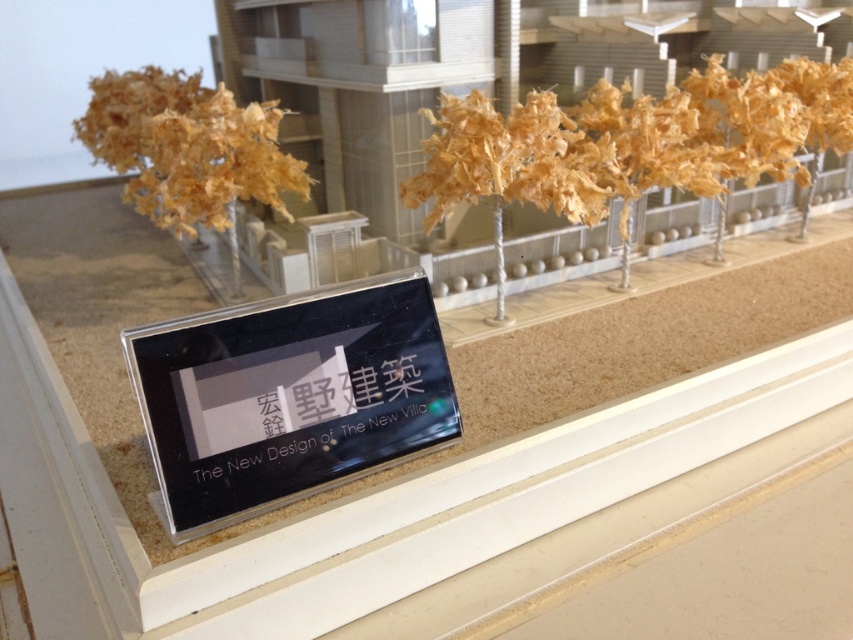
You are examining the architectural model of the villa complex. You notice two points marked in the scene. The first point is located at coordinates point [79,314], and the second is at point [175,195]. From your viewpoint, which point is closer to you?

Point [175,195] is closer to you because it is less further to the camera than point [79,314].

You are a visitor at the architectural model exhibition. You see the point marked at coordinate [636,140]. What does this point indicate?

The point at coordinate [636,140] indicates light brown papier mache trees at upper center.

You are examining a miniature architectural model of a villa complex. You notice two points marked in the scene. The first point is located at coordinates point (425, 182), and the second point is at point (224, 209). From your perspective as an observer, which of these two points appears closer to you?

Point (425, 182) is closer to the camera than point (224, 209).